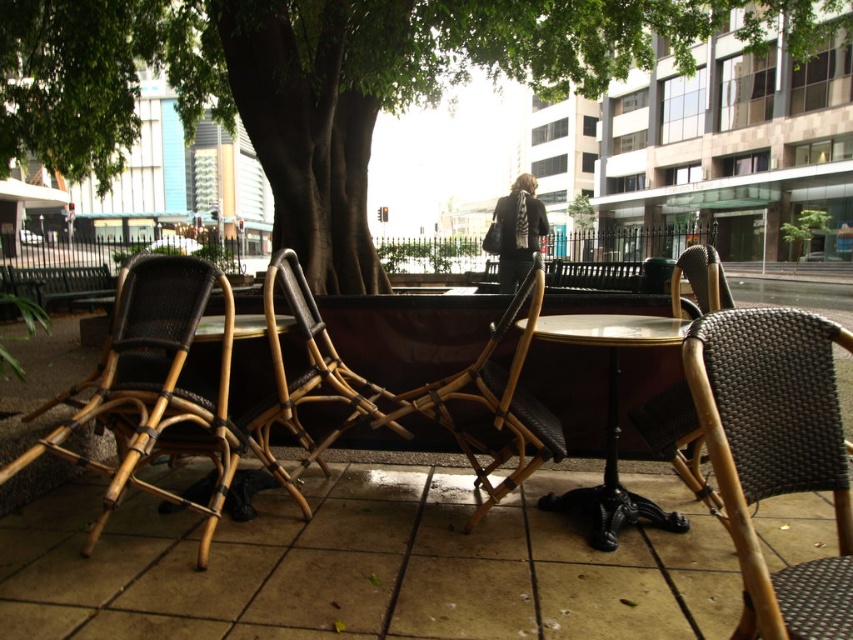
Question: Can you confirm if woven rattan chair at right is positioned below bamboo wicker chair at left?

Choices:
 (A) no
 (B) yes

Answer: (A)

Question: Can you confirm if bamboo wicker chair at center is bigger than matte black table at center?

Choices:
 (A) yes
 (B) no

Answer: (A)

Question: Which object appears farthest from the camera in this image?

Choices:
 (A) bamboo wicker chair at center
 (B) woven rattan chair at right

Answer: (A)

Question: Can you confirm if bamboo wicker chair at left is positioned above matte black table at center?

Choices:
 (A) yes
 (B) no

Answer: (B)

Question: Estimate the real-world distances between objects in this image. Which object is farther from the green wicker chair at center?

Choices:
 (A) bamboo wicker chair at left
 (B) woven rattan chair at right

Answer: (B)

Question: Which is farther from the bamboo wicker chair at center?

Choices:
 (A) woven rattan chair at right
 (B) matte black table at center
 (C) green wicker chair at center

Answer: (C)